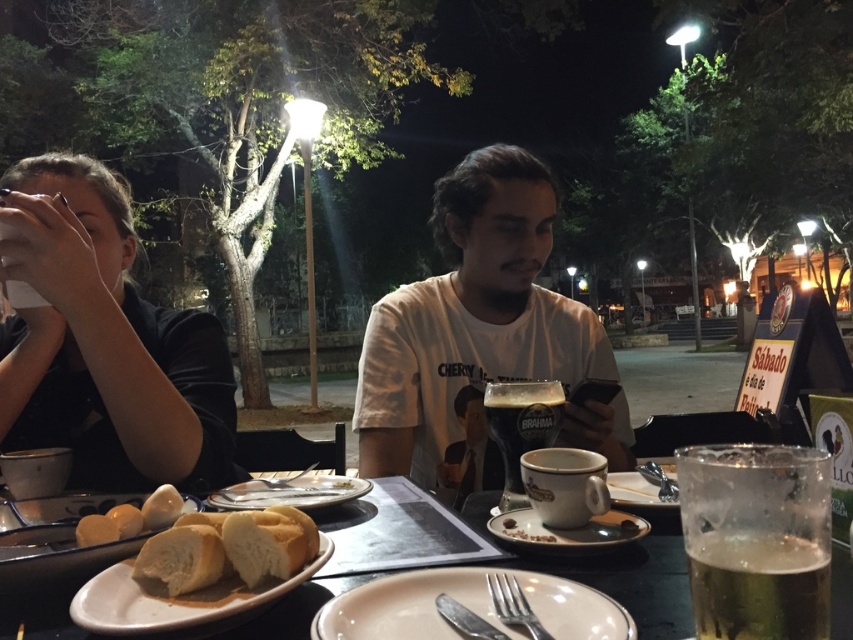
Does white matte plate at center appear under golden matte bread at lower left?

Yes, white matte plate at center is below golden matte bread at lower left.

Does white matte plate at center have a lesser width compared to golden matte bread at lower left?

No.

You are a GUI agent. You are given a task and a screenshot of the screen. Output one action in this format:
    pyautogui.click(x=<x>, y=<y>)
    Task: Click on the white matte plate at center
    
    Given the screenshot: What is the action you would take?
    pyautogui.click(x=289, y=492)

Which is in front, point (466, 195) or point (213, 506)?

Point (213, 506) is in front.

Based on the photo, can you confirm if white cotton t-shirt at center is positioned to the right of white matte plate at center?

Yes, white cotton t-shirt at center is to the right of white matte plate at center.

Who is more forward, (456,413) or (259,477)?

Positioned in front is point (456,413).

At what (x,y) coordinates should I click in order to perform the action: click on white cotton t-shirt at center. Please return your answer as a coordinate pair (x, y). The image size is (853, 640). Looking at the image, I should click on (469, 330).

You are a GUI agent. You are given a task and a screenshot of the screen. Output one action in this format:
    pyautogui.click(x=<x>, y=<y>)
    Task: Click on the porcelain plate at center
    The height and width of the screenshot is (640, 853).
    Given the screenshot: What is the action you would take?
    pyautogui.click(x=466, y=605)

Does point (427, 625) lie behind point (119, 582)?

No, it is not.

Measure the distance between point (436, 570) and camera.

22.26 inches

Identify the location of porcelain plate at center. (466, 605).